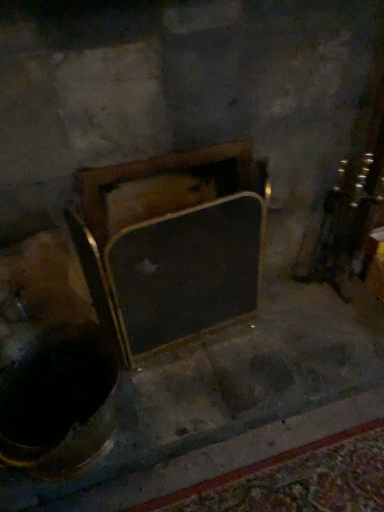
Question: Should I look upward or downward to see metallic gold frame at center?

Choices:
 (A) down
 (B) up

Answer: (A)